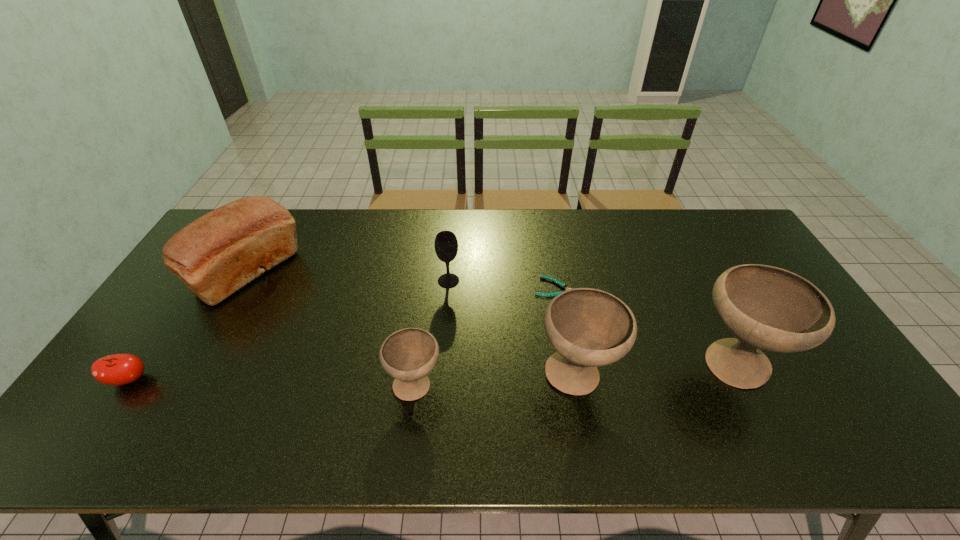
Locate an element on the screen. the leftmost chalice is located at coordinates (408, 355).

Find the location of a particular element. The image size is (960, 540). the shortest chalice is located at coordinates (408, 355).

Locate an element on the screen. the second chalice from right to left is located at coordinates (589, 328).

This screenshot has width=960, height=540. I want to click on the rightmost chalice, so click(767, 308).

Locate an element on the screen. The image size is (960, 540). the fourth shortest object is located at coordinates (446, 245).

You are a GUI agent. You are given a task and a screenshot of the screen. Output one action in this format:
    pyautogui.click(x=<x>, y=<y>)
    Task: Click on the bread
    The height and width of the screenshot is (540, 960).
    Given the screenshot: What is the action you would take?
    [216, 255]

Where is `the sixth tallest object`? the sixth tallest object is located at coordinates (118, 369).

Find the location of a particular element. The image size is (960, 540). the shortest object is located at coordinates (562, 285).

Identify the location of vacant region located on the back of the fifth tallest object. (426, 298).

The image size is (960, 540). I want to click on free space located on the back of the second tallest chalice, so click(561, 290).